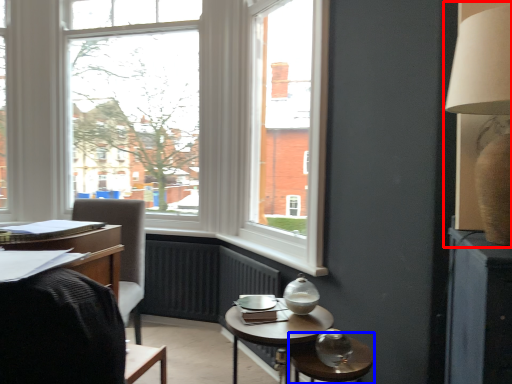
Question: Which point is further to the camera, table lamp (highlighted by a red box) or glass table (highlighted by a blue box)?

Choices:
 (A) table lamp
 (B) glass table

Answer: (B)